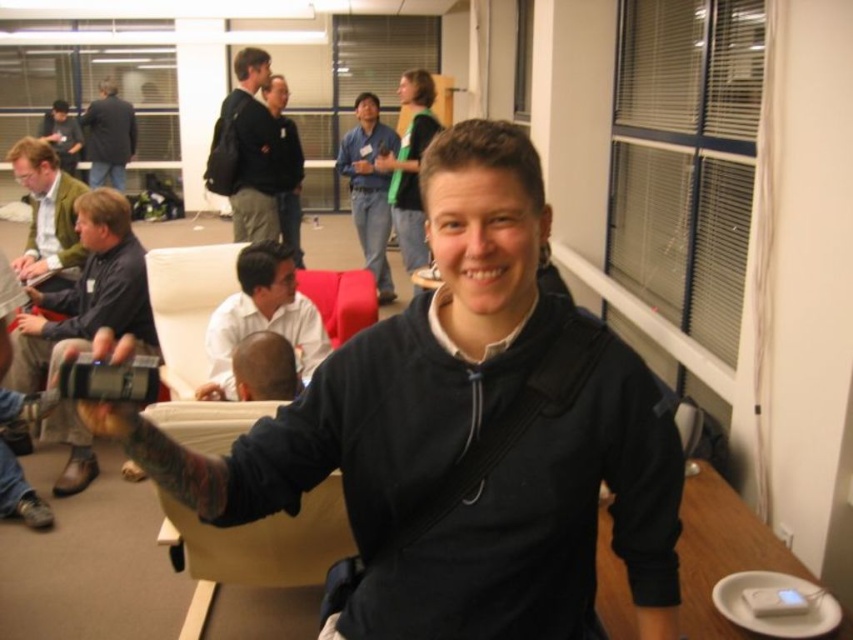
Question: Which of the following is the farthest from the observer?

Choices:
 (A) matte green jacket at left
 (B) black matte jacket at center
 (C) matte black camera at left

Answer: (B)

Question: Which of these objects is positioned closest to the dark blue jacket at upper left?

Choices:
 (A) white glossy plate at lower right
 (B) matte black camera at left
 (C) black matte hoodie at center
 (D) white shirt at center

Answer: (B)

Question: In this image, where is brown hair at center located relative to matte black laptop at upper left?

Choices:
 (A) below
 (B) above

Answer: (A)

Question: Is the position of black matte hoodie at center less distant than that of blue shirt at center?

Choices:
 (A) yes
 (B) no

Answer: (A)

Question: Which is nearer to the black matte hoodie at center?

Choices:
 (A) white shirt at center
 (B) dark blue jacket at upper left
 (C) matte black camera at left

Answer: (A)

Question: Is the position of blue shirt at center more distant than that of brown hair at center?

Choices:
 (A) no
 (B) yes

Answer: (B)